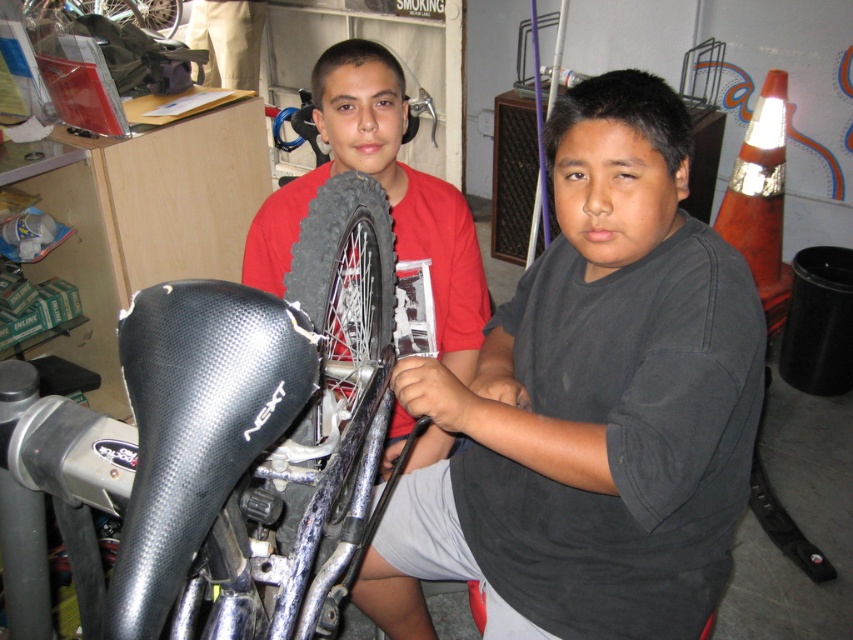
Does black matte shirt at center have a greater height compared to black rubber tire at upper left?

Indeed, black matte shirt at center has a greater height compared to black rubber tire at upper left.

Does point (676, 472) lie behind point (173, 13)?

No.

Image resolution: width=853 pixels, height=640 pixels. What are the coordinates of `black matte shirt at center` in the screenshot? It's located at (x=590, y=404).

Between black matte shirt at center and beige fabric pants at upper left, which one has less height?

Standing shorter between the two is beige fabric pants at upper left.

Measure the distance between black matte shirt at center and beige fabric pants at upper left.

black matte shirt at center is 11.19 feet from beige fabric pants at upper left.

Does point (659, 442) lie behind point (227, 35)?

That is False.

Where is `black matte shirt at center`? black matte shirt at center is located at coordinates (590, 404).

Is matte black bicycle wheel at center shorter than beige fabric pants at upper left?

No, matte black bicycle wheel at center is not shorter than beige fabric pants at upper left.

Who is lower down, matte black bicycle wheel at center or beige fabric pants at upper left?

matte black bicycle wheel at center is below.

Which is behind, point (350, 132) or point (238, 86)?

Positioned behind is point (238, 86).

You are a GUI agent. You are given a task and a screenshot of the screen. Output one action in this format:
    pyautogui.click(x=<x>, y=<y>)
    Task: Click on the matte black bicycle wheel at center
    Image resolution: width=853 pixels, height=640 pixels.
    Given the screenshot: What is the action you would take?
    pyautogui.click(x=386, y=195)